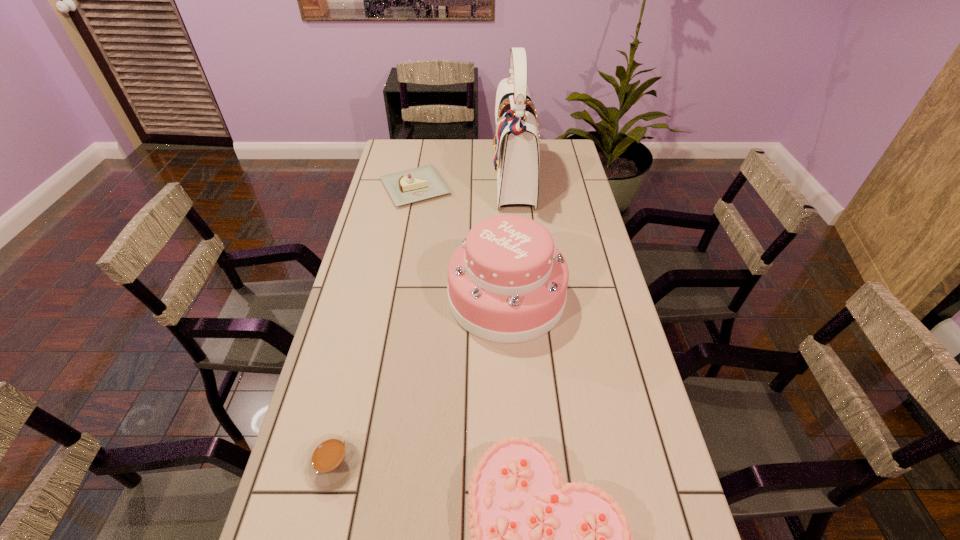
I want to click on the tallest object, so click(x=516, y=152).

This screenshot has height=540, width=960. In order to click on the second tallest object in this screenshot , I will do `click(507, 283)`.

Where is `the second farthest cake`? the second farthest cake is located at coordinates (507, 283).

I want to click on the leftmost cake, so click(x=404, y=187).

At what (x,y) coordinates should I click in order to perform the action: click on the shortest cake. Please return your answer as a coordinate pair (x, y). The height and width of the screenshot is (540, 960). Looking at the image, I should click on pos(404,187).

Locate an element on the screen. This screenshot has width=960, height=540. cappuccino is located at coordinates (333, 460).

Image resolution: width=960 pixels, height=540 pixels. I want to click on vacant space positioned 0.150m on the front-facing side of the tallest object, so click(454, 180).

Identify the location of free space located on the front-facing side of the tallest object. The image size is (960, 540). (449, 180).

Where is `free point located on the front-facing side of the tallest object`? Image resolution: width=960 pixels, height=540 pixels. free point located on the front-facing side of the tallest object is located at coordinates (454, 180).

Locate an element on the screen. This screenshot has height=540, width=960. free space located 0.130m on the front of the tallest cake is located at coordinates (512, 387).